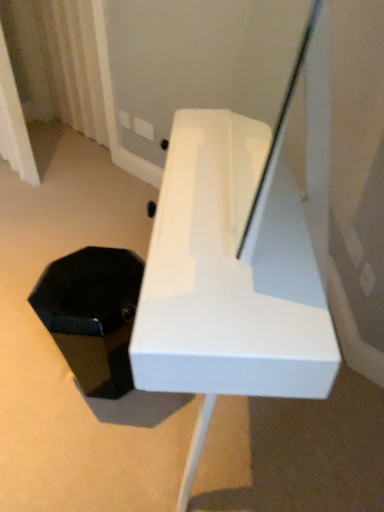
Locate an element on the screen. The image size is (384, 512). empty space that is ontop of black matte hexagonal box at lower left is located at coordinates (89, 280).